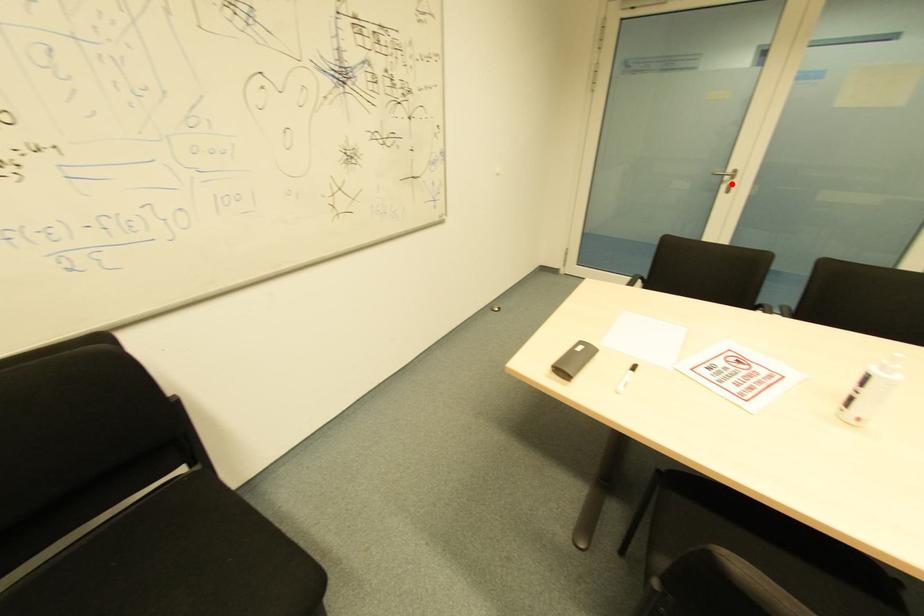
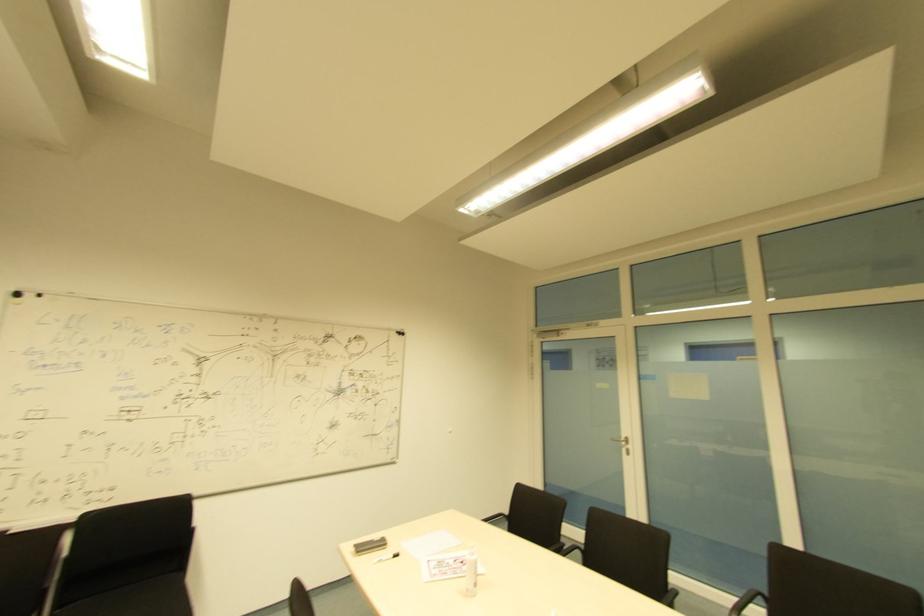
Question: I am providing you with two images of the same scene from different viewpoints. In image1, a red point is highlighted. Considering the same 3D point in image2, which of the following is correct?

Choices:
 (A) It is closer
 (B) It is farther

Answer: (B)